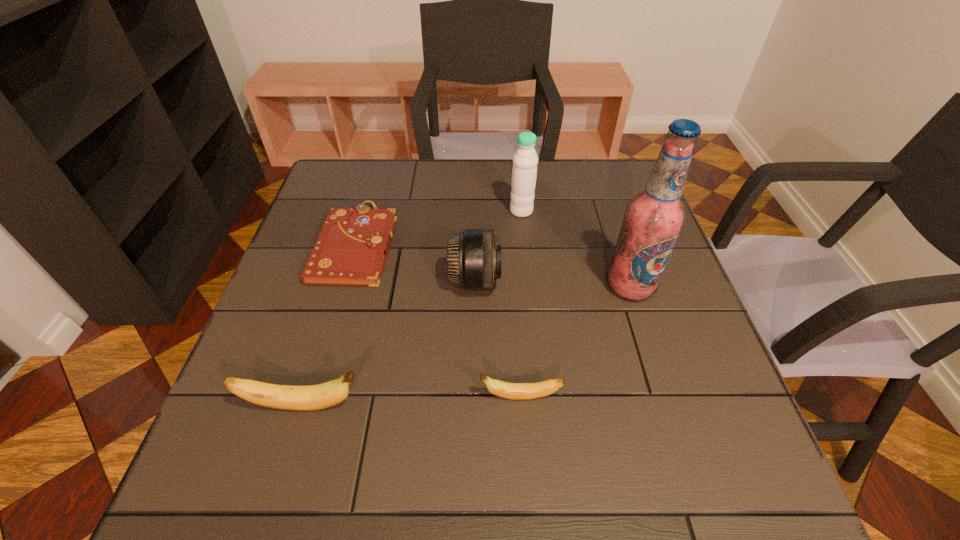
You are a GUI agent. You are given a task and a screenshot of the screen. Output one action in this format:
    pyautogui.click(x=<x>, y=<y>)
    Task: Click on the free space located at the stem of the second shortest object
    The image size is (960, 540).
    Given the screenshot: What is the action you would take?
    pyautogui.click(x=443, y=397)

What are the coordinates of `free region located at the stem of the second shortest object` in the screenshot? It's located at (437, 397).

You are a GUI agent. You are given a task and a screenshot of the screen. Output one action in this format:
    pyautogui.click(x=<x>, y=<y>)
    Task: Click on the free space located at the stem of the second shortest object
    
    Given the screenshot: What is the action you would take?
    pyautogui.click(x=324, y=397)

Locate an element on the screen. The width and height of the screenshot is (960, 540). free location located 0.160m on the left of the water bottle is located at coordinates (451, 211).

Where is `vacant position located on the front-facing side of the telephoto lens`? vacant position located on the front-facing side of the telephoto lens is located at coordinates (589, 281).

This screenshot has width=960, height=540. I want to click on blank space located on the front of the notebook, so click(303, 424).

At what (x,y) coordinates should I click in order to perform the action: click on free point located 0.210m on the left of the rightmost object. Please return your answer as a coordinate pair (x, y). The width and height of the screenshot is (960, 540). Looking at the image, I should click on click(515, 286).

At what (x,y) coordinates should I click in order to perform the action: click on object positioned at the far edge. Please return your answer as a coordinate pair (x, y). Image resolution: width=960 pixels, height=540 pixels. Looking at the image, I should click on (524, 171).

The height and width of the screenshot is (540, 960). I want to click on banana that is at the left edge, so click(289, 397).

Locate an element on the screen. notebook that is at the left edge is located at coordinates (351, 249).